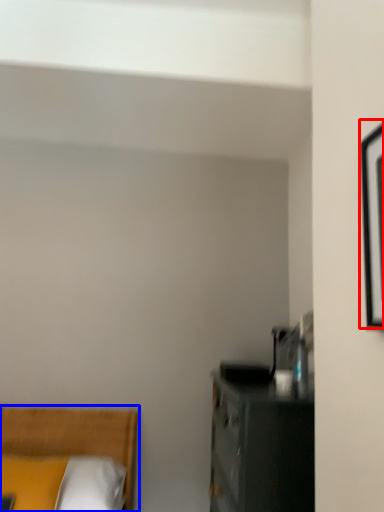
Question: Which of the following is the closest to the observer, picture frame (highlighted by a red box) or bed (highlighted by a blue box)?

Choices:
 (A) picture frame
 (B) bed

Answer: (A)